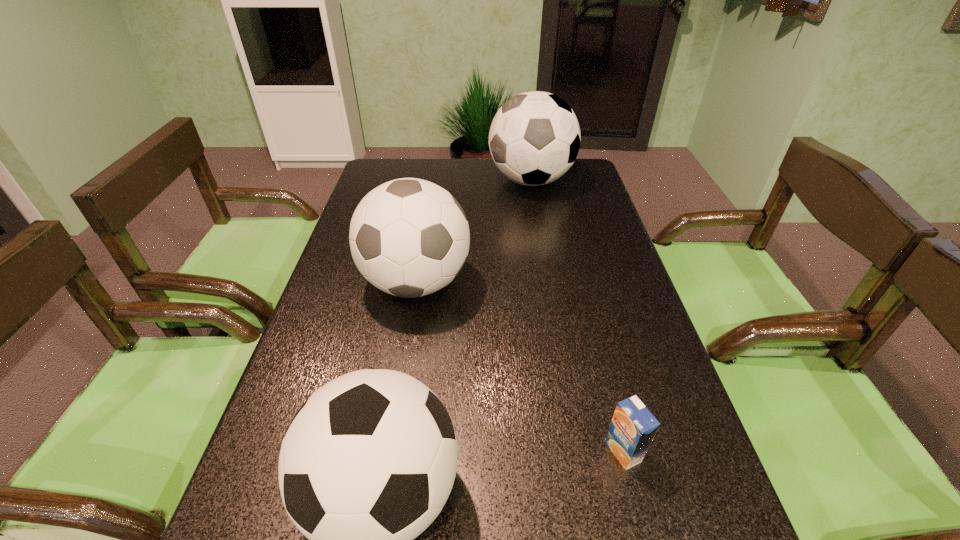
Where is `object that is at the left edge`? This screenshot has height=540, width=960. object that is at the left edge is located at coordinates (409, 237).

Identify the location of soccer ball that is positioned at the right edge. (534, 138).

I want to click on orange_juice positioned at the right edge, so click(x=632, y=429).

Locate an element on the screen. Image resolution: width=960 pixels, height=540 pixels. object that is at the far right corner is located at coordinates (534, 138).

Where is `blank space at the far edge of the desktop`? blank space at the far edge of the desktop is located at coordinates (418, 172).

The image size is (960, 540). Identify the location of vacant space at the left edge of the desktop. [x=375, y=345].

In the image, there is a desktop. At what (x,y) coordinates should I click in order to perform the action: click on vacant space at the right edge. Please return your answer as a coordinate pair (x, y). This screenshot has height=540, width=960. Looking at the image, I should click on (593, 260).

Find the location of a particular element. This screenshot has height=540, width=960. free location at the far left corner of the desktop is located at coordinates (399, 161).

At what (x,y) coordinates should I click in order to perform the action: click on free spot between the farthest soccer ball and the shortest object. Please return your answer as a coordinate pair (x, y). Looking at the image, I should click on click(577, 316).

Identify the location of empty space that is in between the farthest soccer ball and the third nearest object. (473, 232).